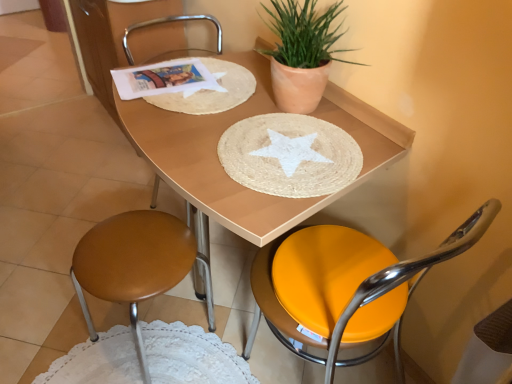
Where is `vacant area on top of white paper at upper left (from a real-world perspective)`? vacant area on top of white paper at upper left (from a real-world perspective) is located at coordinates (164, 77).